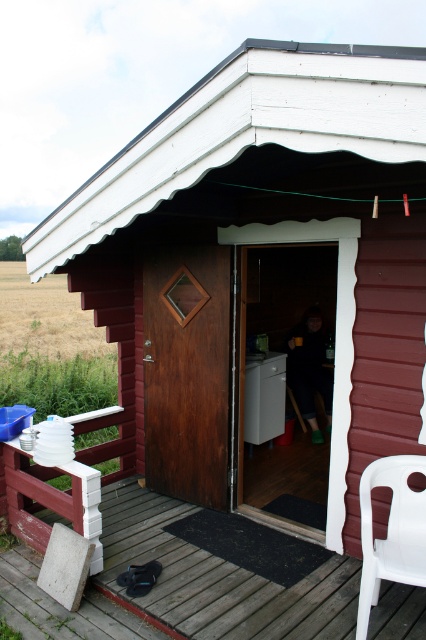
Measure the distance between wooden deck at lower left and camera.

wooden deck at lower left is 2.74 meters away from camera.

Between point (132, 544) and point (310, 356), which one is positioned behind?

The point (310, 356) is behind.

Who is more forward, (388, 602) or (307, 310)?

Point (388, 602) is in front.

Where is `wooden deck at lower left`? Image resolution: width=426 pixels, height=640 pixels. wooden deck at lower left is located at coordinates [x=216, y=580].

Can you confirm if wooden deck at lower left is taller than white plastic chair at lower right?

In fact, wooden deck at lower left may be shorter than white plastic chair at lower right.

Is wooden deck at lower left to the right of white plastic chair at lower right from the viewer's perspective?

Incorrect, wooden deck at lower left is not on the right side of white plastic chair at lower right.

At what (x,y) coordinates should I click in order to perform the action: click on wooden deck at lower left. Please return your answer as a coordinate pair (x, y). Looking at the image, I should click on (216, 580).

Which is in front, point (379, 474) or point (305, 340)?

Point (379, 474) is more forward.

Between white plastic chair at lower right and dark brown leather jacket at center, which one appears on the left side from the viewer's perspective?

From the viewer's perspective, white plastic chair at lower right appears more on the left side.

Does point (389, 547) come closer to viewer compared to point (287, 376)?

That is True.

Where is `white plastic chair at lower right`? This screenshot has height=640, width=426. white plastic chair at lower right is located at coordinates (391, 531).